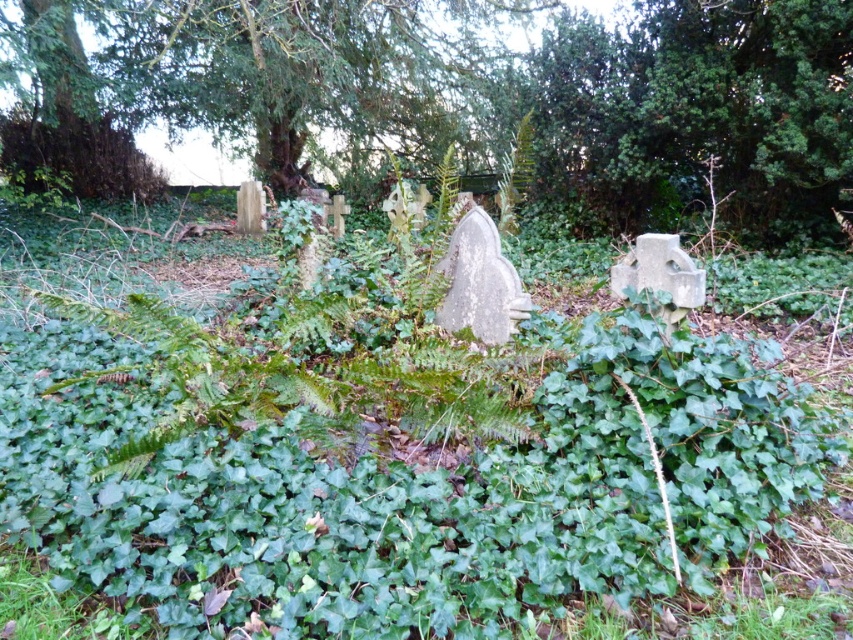
Can you confirm if green leafy tree at upper center is positioned to the right of green leafy bush at upper left?

Yes, green leafy tree at upper center is to the right of green leafy bush at upper left.

Is green leafy tree at upper center further to camera compared to green leafy bush at upper left?

No.

Identify the location of green leafy tree at upper center. (247, 77).